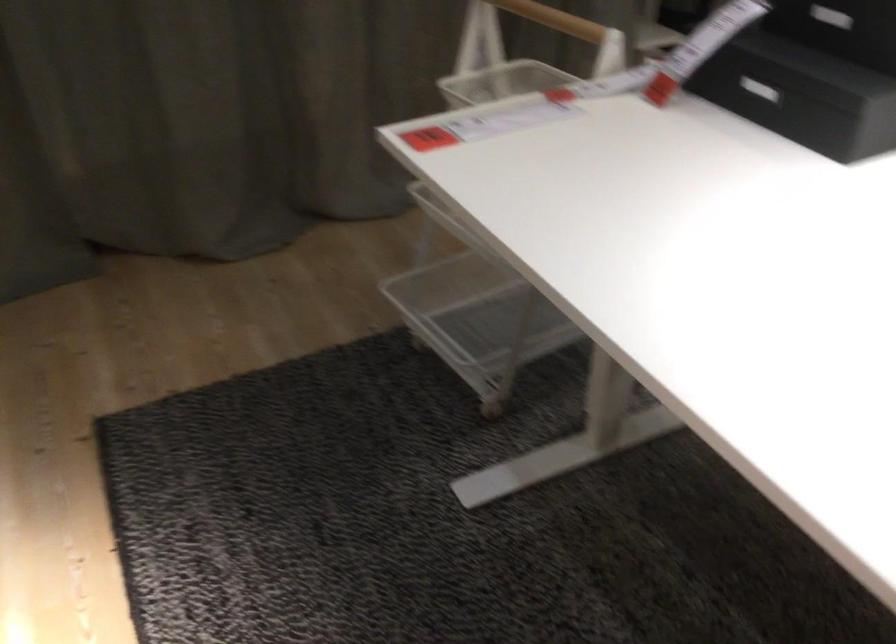
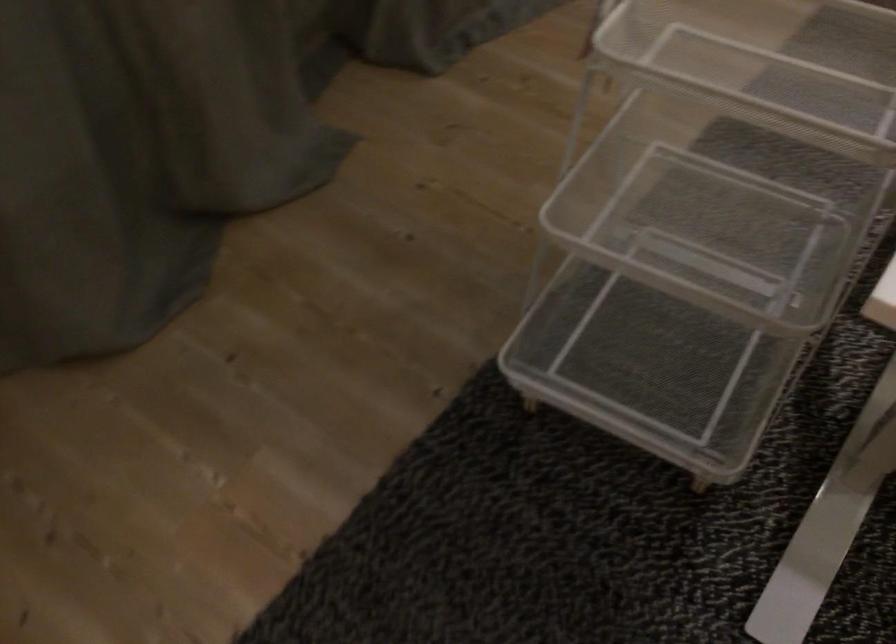
Find the pixel in the second image that matches the point at 497,328 in the first image.

(651, 361)